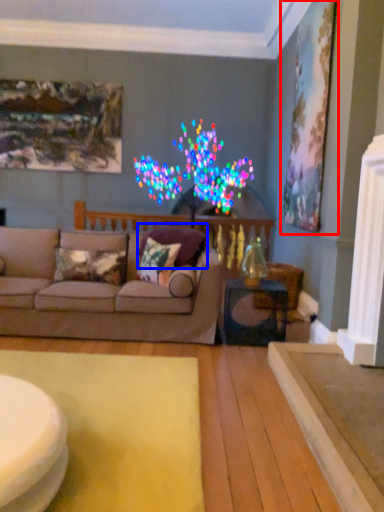
Question: Which object appears closest to the camera in this image, picture frame (highlighted by a red box) or pillow (highlighted by a blue box)?

Choices:
 (A) picture frame
 (B) pillow

Answer: (B)